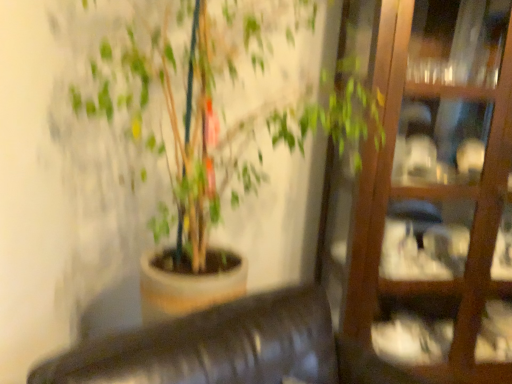
Question: Considering the positions of wooden glass door at right and matte brown pot at center in the image, is wooden glass door at right wider or thinner than matte brown pot at center?

Choices:
 (A) wide
 (B) thin

Answer: (B)

Question: Would you say wooden glass door at right is to the left or to the right of matte brown pot at center in the picture?

Choices:
 (A) left
 (B) right

Answer: (B)

Question: Considering their positions, is wooden glass door at right located in front of or behind matte brown pot at center?

Choices:
 (A) behind
 (B) front

Answer: (A)

Question: Is matte brown pot at center in front of or behind wooden glass door at right in the image?

Choices:
 (A) front
 (B) behind

Answer: (A)

Question: Is matte brown pot at center bigger or smaller than wooden glass door at right?

Choices:
 (A) big
 (B) small

Answer: (A)

Question: Would you say matte brown pot at center is to the left or to the right of wooden glass door at right in the picture?

Choices:
 (A) right
 (B) left

Answer: (B)

Question: Considering the positions of matte brown pot at center and wooden glass door at right in the image, is matte brown pot at center taller or shorter than wooden glass door at right?

Choices:
 (A) tall
 (B) short

Answer: (B)